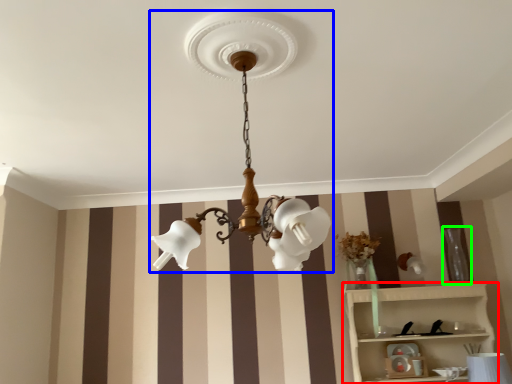
Question: Considering the real-world distances, which object is closest to shelf (highlighted by a red box)? lamp (highlighted by a blue box) or vase (highlighted by a green box).

Choices:
 (A) lamp
 (B) vase

Answer: (B)